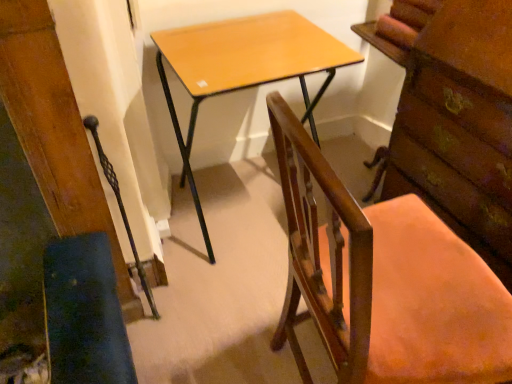
Where is `wooden swivel chair at lower left`? The image size is (512, 384). wooden swivel chair at lower left is located at coordinates (120, 208).

From the image's perspective, is wooden swivel chair at lower left located above or below wooden chest of drawers at right?

Based on their image positions, wooden swivel chair at lower left is located beneath wooden chest of drawers at right.

Find the location of a particular element. chest of drawers behind the wooden swivel chair at lower left is located at coordinates (458, 124).

Considering the sizes of wooden swivel chair at lower left and wooden chest of drawers at right in the image, is wooden swivel chair at lower left bigger or smaller than wooden chest of drawers at right?

Clearly, wooden swivel chair at lower left is smaller in size than wooden chest of drawers at right.

Measure the distance from wooden chair at center to wooden chest of drawers at right.

A distance of 15.89 inches exists between wooden chair at center and wooden chest of drawers at right.

What's the angular difference between wooden chair at center and wooden chest of drawers at right's facing directions?

They differ by 174 degrees in their facing directions.

Considering the positions of objects wooden chair at center and wooden chest of drawers at right in the image provided, who is more to the left, wooden chair at center or wooden chest of drawers at right?

wooden chair at center.

From a real-world perspective, is wooden chair at center positioned over wooden chest of drawers at right based on gravity?

Indeed, from a real-world perspective, wooden chair at center stands above wooden chest of drawers at right.

How far apart are wooden swivel chair at lower left and wooden chair at center?

They are 29.08 inches apart.

Considering the sizes of objects wooden swivel chair at lower left and wooden chair at center in the image provided, who is taller, wooden swivel chair at lower left or wooden chair at center?

wooden chair at center.

From a real-world perspective, is wooden swivel chair at lower left under wooden chair at center?

Yes, from a real-world perspective, wooden swivel chair at lower left is beneath wooden chair at center.

Is light brown wood desk at center spatially inside wooden chest of drawers at right, or outside of it?

light brown wood desk at center is located beyond the bounds of wooden chest of drawers at right.

From a real-world perspective, relative to wooden chest of drawers at right, is light brown wood desk at center vertically above or below?

In terms of real-world spatial position, light brown wood desk at center is above wooden chest of drawers at right.

Does light brown wood desk at center touch wooden chest of drawers at right?

No, light brown wood desk at center is not next to wooden chest of drawers at right.

Where is `chest of drawers on the right side of light brown wood desk at center`? This screenshot has width=512, height=384. chest of drawers on the right side of light brown wood desk at center is located at coordinates (458, 124).

Considering the sizes of objects light brown wood desk at center and wooden chair at center in the image provided, who is taller, light brown wood desk at center or wooden chair at center?

wooden chair at center is taller.

Is light brown wood desk at center oriented away from wooden chair at center?

No, wooden chair at center is not at the back of light brown wood desk at center.

Would you say light brown wood desk at center is inside or outside wooden chair at center?

The correct answer is: outside.

Which of these two, light brown wood desk at center or wooden chair at center, is thinner?

wooden chair at center is thinner.

Locate an element on the screen. This screenshot has width=512, height=384. desk above the wooden chest of drawers at right (from a real-world perspective) is located at coordinates (245, 67).

Is wooden chest of drawers at right wider than light brown wood desk at center?

No.

Is wooden chest of drawers at right taller than light brown wood desk at center?

No, wooden chest of drawers at right is not taller than light brown wood desk at center.

Which point is more forward, (475, 75) or (280, 27)?

The point (475, 75) is closer to the camera.

Considering the sizes of objects wooden swivel chair at lower left and light brown wood desk at center in the image provided, who is taller, wooden swivel chair at lower left or light brown wood desk at center?

wooden swivel chair at lower left.

Consider the image. From the image's perspective, which object appears higher, wooden swivel chair at lower left or light brown wood desk at center?

light brown wood desk at center is shown above in the image.

Is wooden swivel chair at lower left touching light brown wood desk at center?

wooden swivel chair at lower left and light brown wood desk at center are clearly separated.

Find the location of a particular element. The image size is (512, 384). swivel chair in front of the wooden chest of drawers at right is located at coordinates (120, 208).

Locate an element on the screen. The image size is (512, 384). chest of drawers behind the wooden chair at center is located at coordinates (458, 124).

Looking at the image, which one is located closer to wooden chest of drawers at right, wooden swivel chair at lower left or wooden chair at center?

wooden chair at center is positioned closer to the anchor wooden chest of drawers at right.

From the image, which object appears to be nearer to light brown wood desk at center, wooden chest of drawers at right or wooden chair at center?

wooden chest of drawers at right is positioned closer to the anchor light brown wood desk at center.

Considering their positions, is wooden chest of drawers at right positioned further to wooden chair at center than wooden swivel chair at lower left?

wooden swivel chair at lower left is further to wooden chair at center.

From the image, which object appears to be farther from wooden chest of drawers at right, light brown wood desk at center or wooden swivel chair at lower left?

wooden swivel chair at lower left is further to wooden chest of drawers at right.

Estimate the real-world distances between objects in this image. Which object is closer to light brown wood desk at center, wooden chest of drawers at right or wooden swivel chair at lower left?

The object closer to light brown wood desk at center is wooden chest of drawers at right.

In the scene shown: Estimate the real-world distances between objects in this image. Which object is closer to wooden chair at center, wooden swivel chair at lower left or wooden chest of drawers at right?

wooden chest of drawers at right.

From the image, which object appears to be farther from wooden chair at center, light brown wood desk at center or wooden chest of drawers at right?

Among the two, light brown wood desk at center is located further to wooden chair at center.

Looking at the image, which one is located further to wooden swivel chair at lower left, light brown wood desk at center or wooden chest of drawers at right?

wooden chest of drawers at right is positioned further to the anchor wooden swivel chair at lower left.

Locate an element on the screen. This screenshot has width=512, height=384. desk between wooden swivel chair at lower left and wooden chest of drawers at right is located at coordinates [245, 67].

At what (x,y) coordinates should I click in order to perform the action: click on swivel chair positioned between wooden chair at center and light brown wood desk at center from near to far. Please return your answer as a coordinate pair (x, y). Looking at the image, I should click on (120, 208).

Find the location of `chair between wooden swivel chair at lower left and wooden chest of drawers at right`. chair between wooden swivel chair at lower left and wooden chest of drawers at right is located at coordinates (384, 281).

Where is `desk between wooden chair at center and wooden chest of drawers at right along the z-axis`? Image resolution: width=512 pixels, height=384 pixels. desk between wooden chair at center and wooden chest of drawers at right along the z-axis is located at coordinates (245, 67).